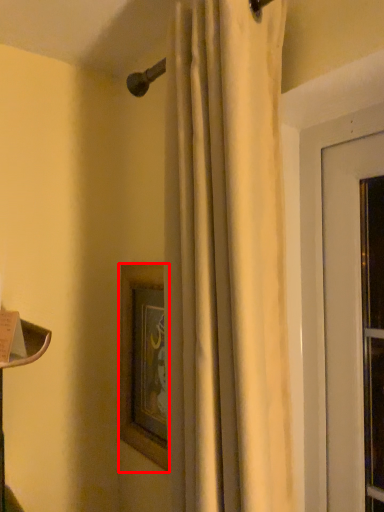
Question: In this image, where is picture frame (annotated by the red box) located relative to curtain?

Choices:
 (A) right
 (B) left

Answer: (B)